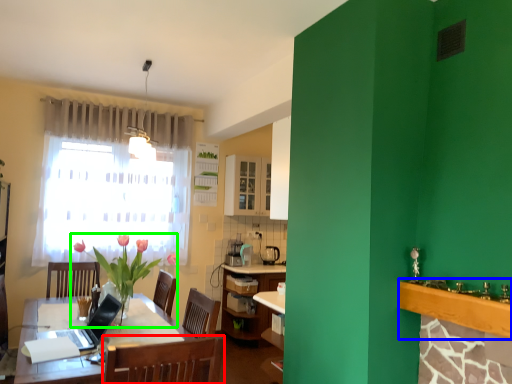
Question: Which object is the farthest from chair (highlighted by a red box)? Choose among these: counter top (highlighted by a blue box) or houseplant (highlighted by a green box).

Choices:
 (A) counter top
 (B) houseplant

Answer: (B)